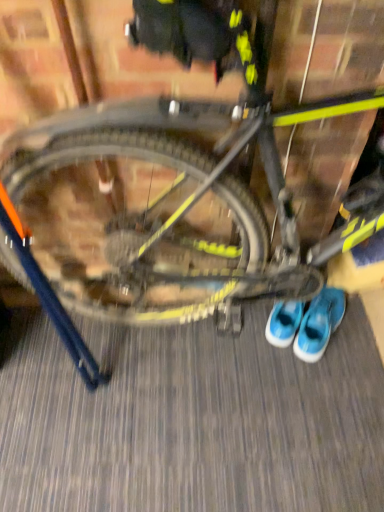
Locate an element on the screen. The image size is (384, 512). blue suede sneakers at lower right is located at coordinates (319, 324).

What do you see at coordinates (319, 324) in the screenshot?
I see `blue suede sneakers at lower right` at bounding box center [319, 324].

Locate an element on the screen. The height and width of the screenshot is (512, 384). blue suede sneakers at lower right is located at coordinates (319, 324).